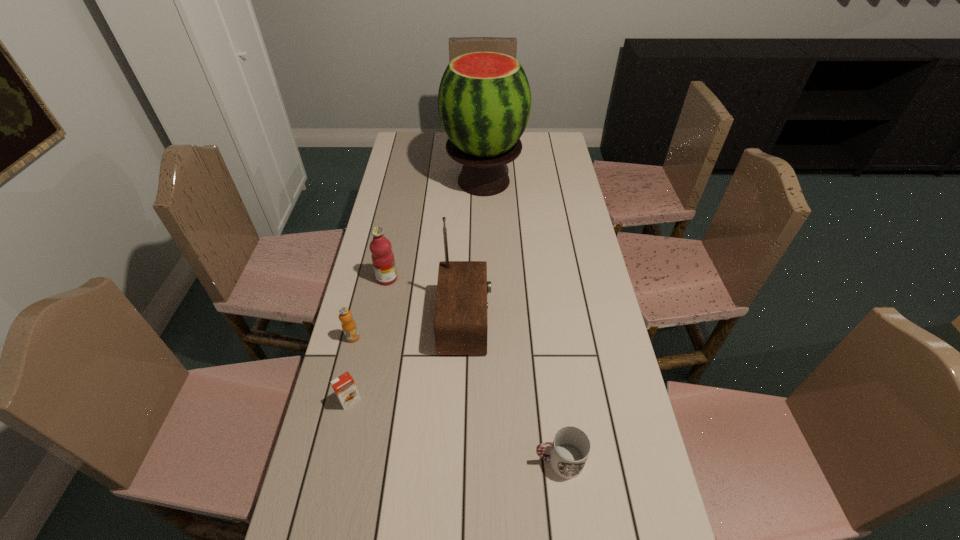
At what (x,y) coordinates should I click in order to perform the action: click on free region located on the front of the farthest object. Please return your answer as a coordinate pair (x, y). This screenshot has height=540, width=960. Looking at the image, I should click on (484, 214).

The height and width of the screenshot is (540, 960). I want to click on vacant space located on the front-facing side of the fifth shortest object, so click(x=606, y=322).

Locate an element on the screen. free space located on the label of the fruit juice is located at coordinates (421, 279).

The image size is (960, 540). Identify the location of free space located on the front label of the third shortest object. (346, 367).

The image size is (960, 540). In order to click on vacant space located on the right of the fifth farthest object in this screenshot , I will do `click(474, 400)`.

Image resolution: width=960 pixels, height=540 pixels. What are the coordinates of `vacant space situated 0.100m on the handle side of the cup` in the screenshot? It's located at (492, 461).

Where is `free location located on the handle side of the cup`? This screenshot has width=960, height=540. free location located on the handle side of the cup is located at coordinates (429, 461).

Locate an element on the screen. The image size is (960, 540). vacant space located 0.310m on the handle side of the cup is located at coordinates (404, 461).

Identify the location of fruit juice that is at the left edge. (382, 256).

In order to click on object situated at the right edge in this screenshot , I will do `click(571, 446)`.